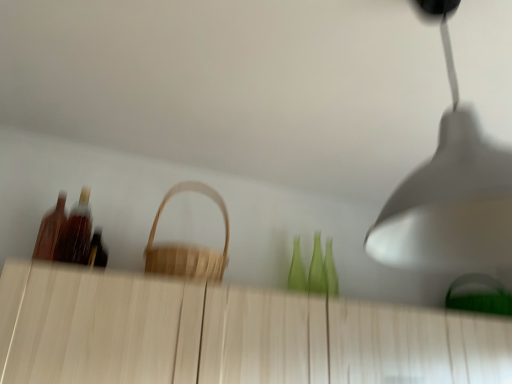
Question: Does natural wood basket at center have a smaller size compared to white matte lampshade at upper right?

Choices:
 (A) yes
 (B) no

Answer: (A)

Question: Is natural wood basket at center not near white matte lampshade at upper right?

Choices:
 (A) no
 (B) yes

Answer: (A)

Question: Is natural wood basket at center oriented away from white matte lampshade at upper right?

Choices:
 (A) no
 (B) yes

Answer: (A)

Question: Can white matte lampshade at upper right be found inside natural wood basket at center?

Choices:
 (A) yes
 (B) no

Answer: (B)

Question: From the image's perspective, is natural wood basket at center below white matte lampshade at upper right?

Choices:
 (A) no
 (B) yes

Answer: (B)

Question: Considering the positions of white matte lampshade at upper right and wooden bottle at left, acting as the first bottle starting from the left, in the image, is white matte lampshade at upper right taller or shorter than wooden bottle at left, acting as the first bottle starting from the left,?

Choices:
 (A) short
 (B) tall

Answer: (B)

Question: Based on their positions, is white matte lampshade at upper right located to the left or right of wooden bottle at left, acting as the first bottle starting from the left?

Choices:
 (A) right
 (B) left

Answer: (A)

Question: From the image's perspective, is white matte lampshade at upper right positioned above or below wooden bottle at left, acting as the first bottle starting from the left?

Choices:
 (A) below
 (B) above

Answer: (B)

Question: Looking at their shapes, would you say white matte lampshade at upper right is wider or thinner than wooden bottle at left, acting as the first bottle starting from the left?

Choices:
 (A) wide
 (B) thin

Answer: (A)

Question: Is point (95, 357) closer or farther from the camera than point (446, 142)?

Choices:
 (A) closer
 (B) farther

Answer: (B)

Question: Considering the positions of light wood dresser at center and white matte lampshade at upper right in the image, is light wood dresser at center wider or thinner than white matte lampshade at upper right?

Choices:
 (A) thin
 (B) wide

Answer: (A)

Question: Relative to white matte lampshade at upper right, is light wood dresser at center in front or behind?

Choices:
 (A) front
 (B) behind

Answer: (B)

Question: Based on their positions, is light wood dresser at center located to the left or right of white matte lampshade at upper right?

Choices:
 (A) left
 (B) right

Answer: (A)

Question: Would you say shiny brown bottle at left, the first bottle from the right, is to the left or to the right of wooden bottle at left, the second bottle from the right, in the picture?

Choices:
 (A) right
 (B) left

Answer: (A)

Question: Is shiny brown bottle at left, acting as the second bottle starting from the left, in front of or behind wooden bottle at left, acting as the first bottle starting from the left, in the image?

Choices:
 (A) behind
 (B) front

Answer: (A)